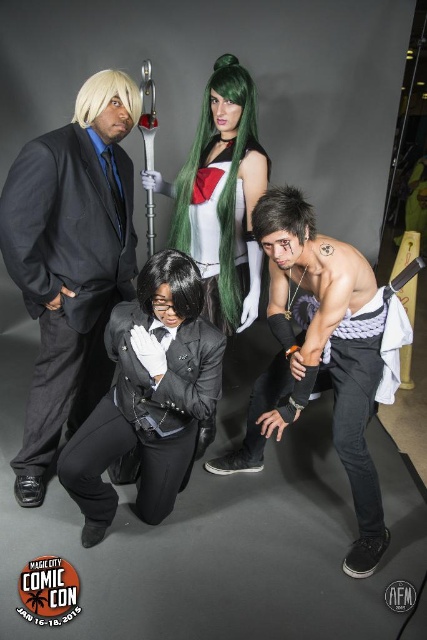
Does matte black suit at left have a greater height compared to shiny green wig at center?

Yes, matte black suit at left is taller than shiny green wig at center.

Is point (35, 182) closer to camera compared to point (187, 216)?

Yes, it is.

Between point (81, 104) and point (192, 186), which one is positioned behind?

Point (192, 186)

Find the location of a particular element. Image resolution: width=427 pixels, height=640 pixels. matte black suit at left is located at coordinates (70, 260).

Can you confirm if shiny black shirt at lower right is thinner than green satin dress at center?

In fact, shiny black shirt at lower right might be wider than green satin dress at center.

Can you confirm if shiny black shirt at lower right is wider than green satin dress at center?

Yes.

In the scene shown: Who is more forward, (370,564) or (222,237)?

Point (370,564) is more forward.

You are a GUI agent. You are given a task and a screenshot of the screen. Output one action in this format:
    pyautogui.click(x=<x>, y=<y>)
    Task: Click on the shiny black shirt at lower right
    The height and width of the screenshot is (640, 427).
    Given the screenshot: What is the action you would take?
    (319, 355)

Which of these two, black satin suit at center or blonde synthetic wig at upper left, stands shorter?

blonde synthetic wig at upper left is shorter.

Does point (189, 355) come behind point (111, 80)?

No.

Describe the element at coordinates (148, 396) in the screenshot. I see `black satin suit at center` at that location.

Identify the location of black satin suit at center. The height and width of the screenshot is (640, 427). (148, 396).